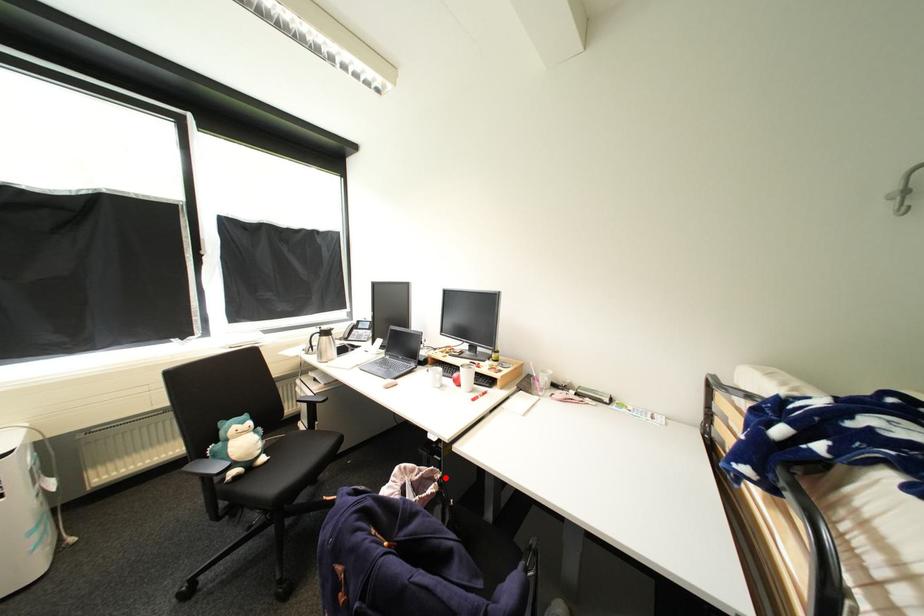
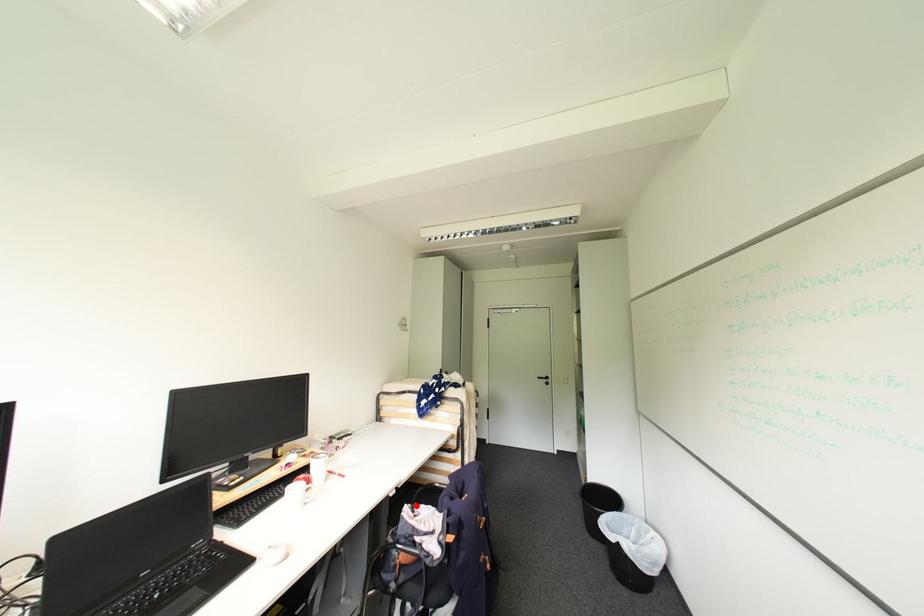
I am providing you with two images of the same scene from different viewpoints. A red point is marked on the first image and another point is marked on the second image. Are the points marked in image1 and image2 representing the same 3D position?

Yes